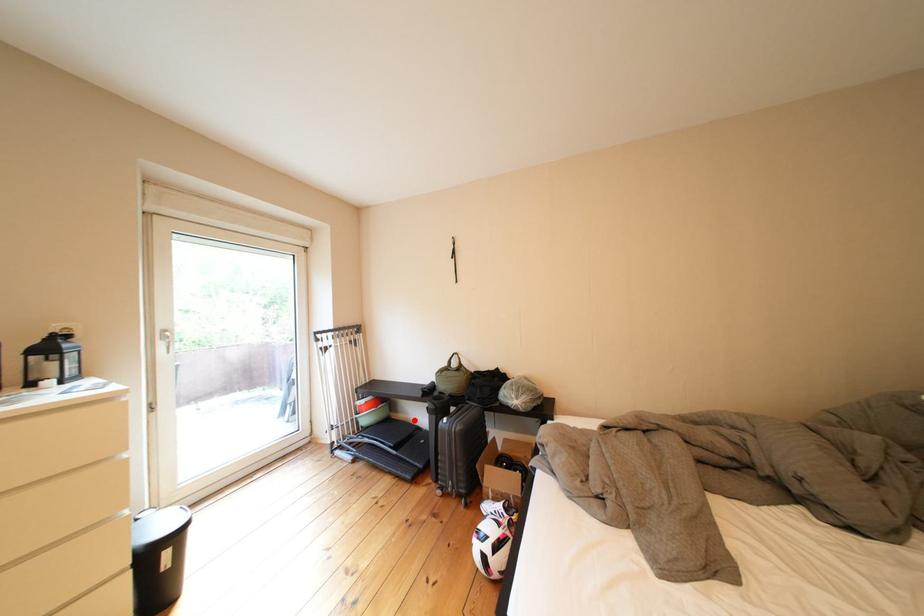
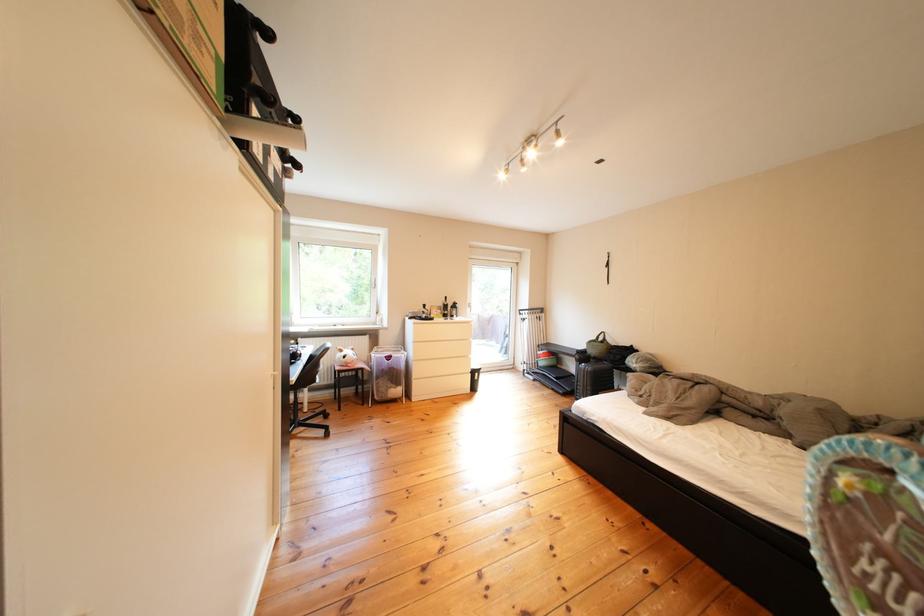
Locate, in the second image, the point that corresponds to the highlighted location in the first image.

(578, 371)